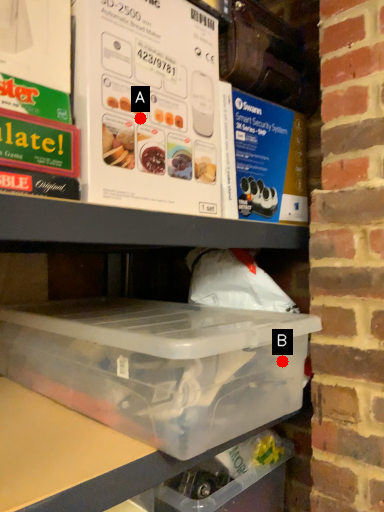
Question: Two points are circled on the image, labeled by A and B beside each circle. Which point is closer to the camera?

Choices:
 (A) A is closer
 (B) B is closer

Answer: (A)